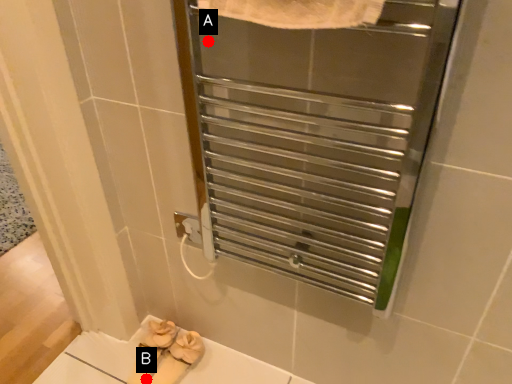
Question: Two points are circled on the image, labeled by A and B beside each circle. Which point appears closest to the camera in this image?

Choices:
 (A) A is closer
 (B) B is closer

Answer: (A)